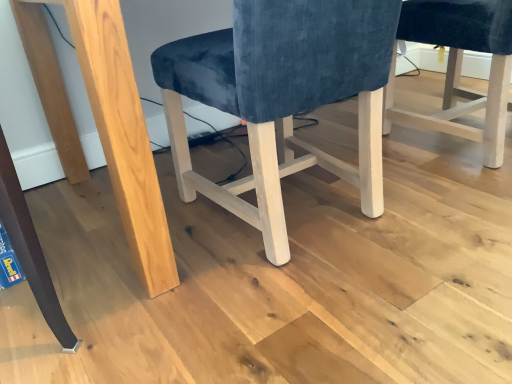
What is the approximate height of velvet blue chair at center, the 2th chair viewed from the left?

21.02 inches.

This screenshot has height=384, width=512. What do you see at coordinates (460, 66) in the screenshot? I see `velvet blue chair at center, which is the first chair in right-to-left order` at bounding box center [460, 66].

Identify the location of velvet blue chair at center, which is the first chair in right-to-left order. (460, 66).

What do you see at coordinates (282, 96) in the screenshot? The image size is (512, 384). I see `velvet blue chair at center, which is the 1th chair from left to right` at bounding box center [282, 96].

Where is `velvet blue chair at center, which is the 1th chair from left to right`? Image resolution: width=512 pixels, height=384 pixels. velvet blue chair at center, which is the 1th chair from left to right is located at coordinates (282, 96).

You are a GUI agent. You are given a task and a screenshot of the screen. Output one action in this format:
    pyautogui.click(x=<x>, y=<y>)
    Task: Click on the velvet blue chair at center, the 2th chair viewed from the left
    This screenshot has width=512, height=384.
    Given the screenshot: What is the action you would take?
    pyautogui.click(x=460, y=66)

Is velvet blue chair at center, which is the 1th chair from left to right, to the right of velvet blue chair at center, the 2th chair viewed from the left, from the viewer's perspective?

No, velvet blue chair at center, which is the 1th chair from left to right, is not to the right of velvet blue chair at center, the 2th chair viewed from the left.

Who is more distant, velvet blue chair at center, acting as the second chair starting from the right, or velvet blue chair at center, the 2th chair viewed from the left?

velvet blue chair at center, the 2th chair viewed from the left, is further away from the camera.

Which point is more forward, (344, 171) or (502, 113)?

The point (502, 113) is closer to the camera.

From the image's perspective, is velvet blue chair at center, which is the 1th chair from left to right, under velvet blue chair at center, the 2th chair viewed from the left?

Correct, velvet blue chair at center, which is the 1th chair from left to right, appears lower than velvet blue chair at center, the 2th chair viewed from the left, in the image.

From a real-world perspective, which object stands above the other?

velvet blue chair at center, which is the 1th chair from left to right.

Is velvet blue chair at center, acting as the second chair starting from the right, wider or thinner than velvet blue chair at center, the 2th chair viewed from the left?

In the image, velvet blue chair at center, acting as the second chair starting from the right, appears to be wider than velvet blue chair at center, the 2th chair viewed from the left.

Between velvet blue chair at center, which is the 1th chair from left to right, and velvet blue chair at center, the 2th chair viewed from the left, which one has more height?

With more height is velvet blue chair at center, which is the 1th chair from left to right.

Does velvet blue chair at center, acting as the second chair starting from the right, have a smaller size compared to velvet blue chair at center, which is the first chair in right-to-left order?

No, velvet blue chair at center, acting as the second chair starting from the right, is not smaller than velvet blue chair at center, which is the first chair in right-to-left order.

Would you say velvet blue chair at center, which is the first chair in right-to-left order, is part of velvet blue chair at center, acting as the second chair starting from the right,'s contents?

No, velvet blue chair at center, which is the first chair in right-to-left order, is not a part of velvet blue chair at center, acting as the second chair starting from the right.

Is the surface of velvet blue chair at center, acting as the second chair starting from the right, in direct contact with velvet blue chair at center, which is the first chair in right-to-left order?

velvet blue chair at center, acting as the second chair starting from the right, and velvet blue chair at center, which is the first chair in right-to-left order, are clearly separated.

Is velvet blue chair at center, which is the 1th chair from left to right, facing away from velvet blue chair at center, the 2th chair viewed from the left?

That's not correct — velvet blue chair at center, which is the 1th chair from left to right, is not looking away from velvet blue chair at center, the 2th chair viewed from the left.

This screenshot has width=512, height=384. Find the location of `chair above the velvet blue chair at center, which is the 1th chair from left to right (from the image's perspective)`. chair above the velvet blue chair at center, which is the 1th chair from left to right (from the image's perspective) is located at coordinates (460, 66).

Considering the relative positions of velvet blue chair at center, the 2th chair viewed from the left, and velvet blue chair at center, which is the 1th chair from left to right, in the image provided, is velvet blue chair at center, the 2th chair viewed from the left, to the left or to the right of velvet blue chair at center, which is the 1th chair from left to right,?

From the image, it's evident that velvet blue chair at center, the 2th chair viewed from the left, is to the right of velvet blue chair at center, which is the 1th chair from left to right.

Is the depth of velvet blue chair at center, which is the first chair in right-to-left order, greater than that of velvet blue chair at center, which is the 1th chair from left to right?

Yes, velvet blue chair at center, which is the first chair in right-to-left order, is further from the camera.

Does point (448, 131) come closer to viewer compared to point (371, 64)?

No, (448, 131) is further to viewer.

From the image's perspective, which is below, velvet blue chair at center, which is the first chair in right-to-left order, or velvet blue chair at center, acting as the second chair starting from the right?

velvet blue chair at center, acting as the second chair starting from the right.

From a real-world perspective, which is physically below, velvet blue chair at center, which is the first chair in right-to-left order, or velvet blue chair at center, acting as the second chair starting from the right?

In real-world perspective, velvet blue chair at center, which is the first chair in right-to-left order, is lower.

Is velvet blue chair at center, which is the first chair in right-to-left order, thinner than velvet blue chair at center, acting as the second chair starting from the right?

Indeed, velvet blue chair at center, which is the first chair in right-to-left order, has a lesser width compared to velvet blue chair at center, acting as the second chair starting from the right.

Considering the sizes of velvet blue chair at center, the 2th chair viewed from the left, and velvet blue chair at center, which is the 1th chair from left to right, in the image, is velvet blue chair at center, the 2th chair viewed from the left, taller or shorter than velvet blue chair at center, which is the 1th chair from left to right,?

Clearly, velvet blue chair at center, the 2th chair viewed from the left, is shorter compared to velvet blue chair at center, which is the 1th chair from left to right.

Based on their sizes in the image, would you say velvet blue chair at center, the 2th chair viewed from the left, is bigger or smaller than velvet blue chair at center, which is the 1th chair from left to right?

Clearly, velvet blue chair at center, the 2th chair viewed from the left, is smaller in size than velvet blue chair at center, which is the 1th chair from left to right.

Would you say velvet blue chair at center, which is the first chair in right-to-left order, is outside velvet blue chair at center, acting as the second chair starting from the right?

Yes, velvet blue chair at center, which is the first chair in right-to-left order, is not within velvet blue chair at center, acting as the second chair starting from the right.

Is velvet blue chair at center, the 2th chair viewed from the left, directly adjacent to velvet blue chair at center, acting as the second chair starting from the right?

They are not placed beside each other.

Is velvet blue chair at center, the 2th chair viewed from the left, turned away from velvet blue chair at center, which is the 1th chair from left to right?

No, velvet blue chair at center, the 2th chair viewed from the left, is not facing away from velvet blue chair at center, which is the 1th chair from left to right.

Find the location of a particular element. chair below the velvet blue chair at center, acting as the second chair starting from the right (from a real-world perspective) is located at coordinates (460, 66).

You are a GUI agent. You are given a task and a screenshot of the screen. Output one action in this format:
    pyautogui.click(x=<x>, y=<y>)
    Task: Click on the chair on the right of velvet blue chair at center, which is the 1th chair from left to right
    The width and height of the screenshot is (512, 384).
    Given the screenshot: What is the action you would take?
    pyautogui.click(x=460, y=66)

In the image, there is a velvet blue chair at center, acting as the second chair starting from the right. What are the coordinates of `chair below it (from a real-world perspective)` in the screenshot? It's located at (460, 66).